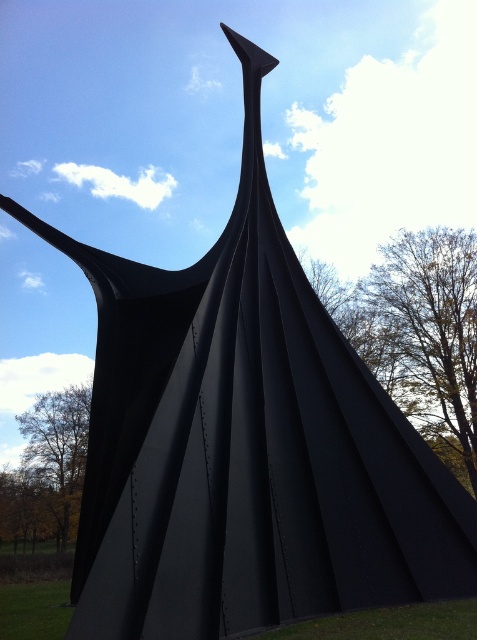
Which is behind, point (60, 476) or point (48, 634)?

Point (60, 476)

Which of these two, brown leafy tree at lower left or green grass at lower left, stands taller?

brown leafy tree at lower left is taller.

Find the location of a particular element. This screenshot has height=640, width=477. brown leafy tree at lower left is located at coordinates (52, 464).

The image size is (477, 640). In order to click on brown leafy tree at lower left in this screenshot , I will do `click(52, 464)`.

From the picture: Can you confirm if green grass at lower center is wider than green grass at lower left?

Incorrect, green grass at lower center's width does not surpass green grass at lower left's.

Find the location of a particular element. green grass at lower center is located at coordinates (387, 624).

Which is behind, point (362, 609) or point (56, 582)?

Positioned behind is point (56, 582).

This screenshot has height=640, width=477. What are the coordinates of `green grass at lower center` in the screenshot? It's located at (387, 624).

Between green leafy tree at upper right and green grass at lower left, which one is positioned lower?

green grass at lower left is below.

Which is in front, point (468, 340) or point (41, 630)?

Point (41, 630)

Measure the distance between green leafy tree at upper right and camera.

green leafy tree at upper right and camera are 67.15 feet apart from each other.

Image resolution: width=477 pixels, height=640 pixels. In order to click on green leafy tree at upper right in this screenshot , I will do click(x=427, y=332).